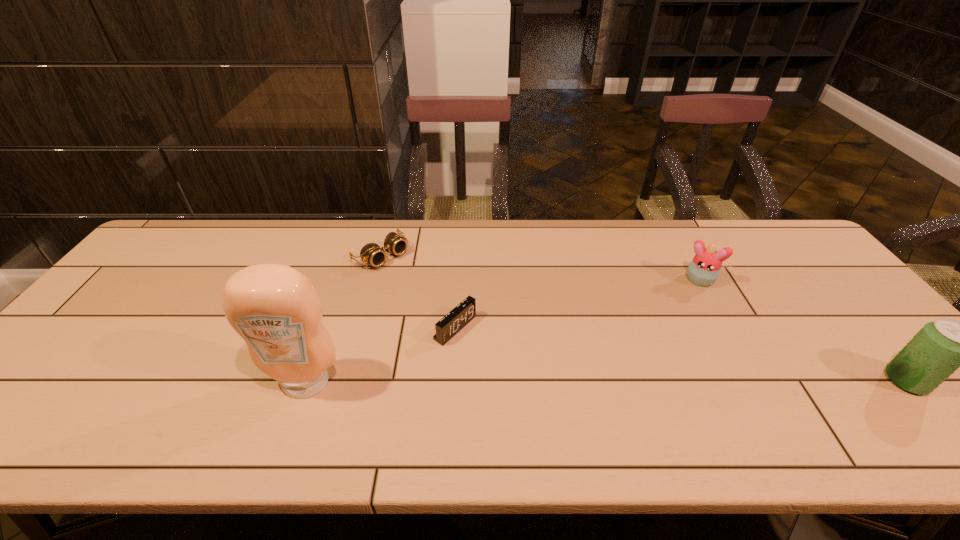
Locate an element on the screen. free spot on the desktop that is between the condiment and the second tallest object and is positioned through the lenses of the goggles is located at coordinates (553, 382).

Where is `vacant space on the desktop that is between the tallest object and the rightmost object and is positioned on the front-facing side of the third farthest object`? vacant space on the desktop that is between the tallest object and the rightmost object and is positioned on the front-facing side of the third farthest object is located at coordinates (543, 382).

You are a GUI agent. You are given a task and a screenshot of the screen. Output one action in this format:
    pyautogui.click(x=<x>, y=<y>)
    Task: Click on the vacant space on the desktop that is between the tallest object and the soda and is positioned on the face of the fourth object from left to right
    
    Given the screenshot: What is the action you would take?
    pyautogui.click(x=660, y=382)